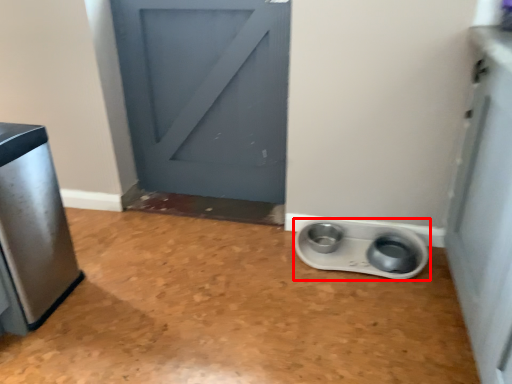
Question: Considering the relative positions of appliance (annotated by the red box) and home appliance in the image provided, where is appliance (annotated by the red box) located with respect to the staircase?

Choices:
 (A) right
 (B) left

Answer: (A)